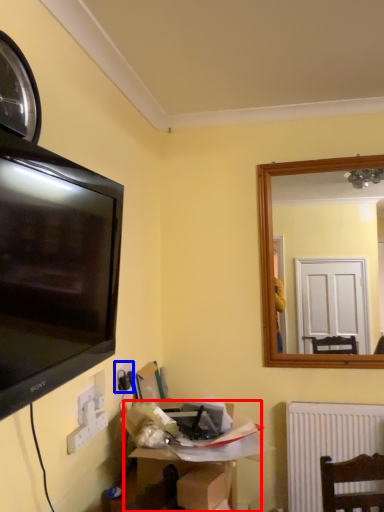
Question: Which point is closer to the camera, cardboard box (highlighted by a red box) or electric outlet (highlighted by a blue box)?

Choices:
 (A) cardboard box
 (B) electric outlet

Answer: (A)